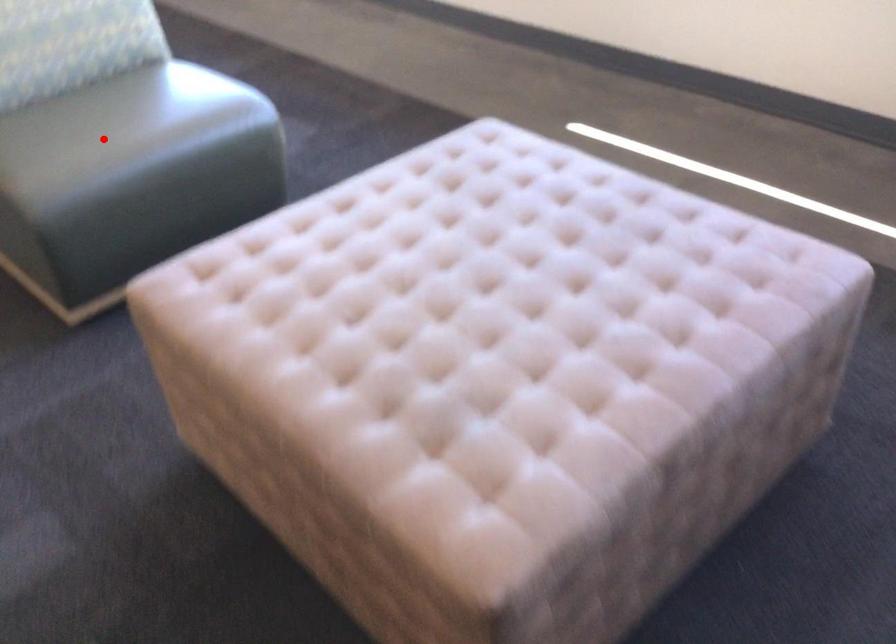
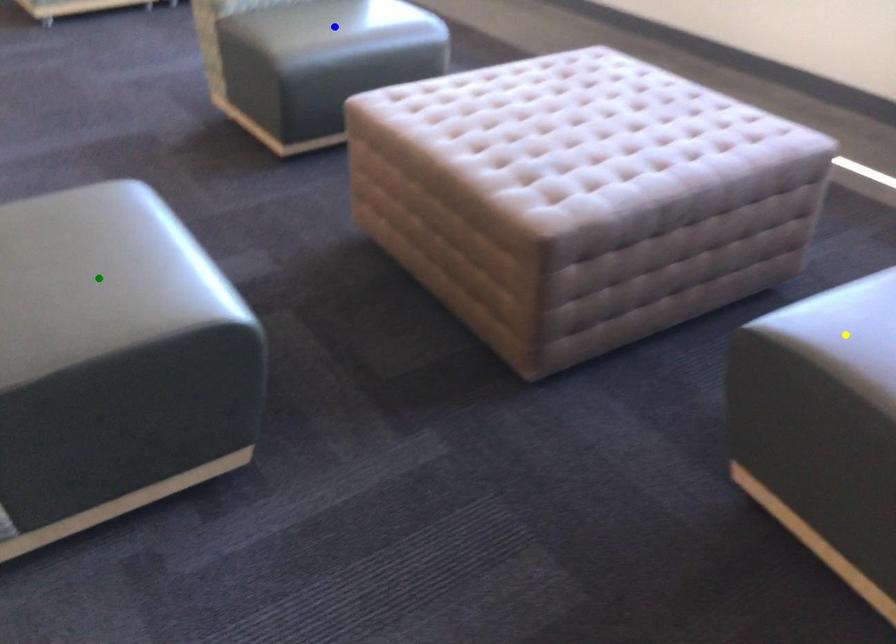
Question: I am providing you with two images of the same scene from different viewpoints. A red point is marked on the first image. You are given multiple points on the second image. Which point in image 2 is actually the same real-world point as the red point in image 1?

Choices:
 (A) yellow point
 (B) blue point
 (C) green point

Answer: (B)